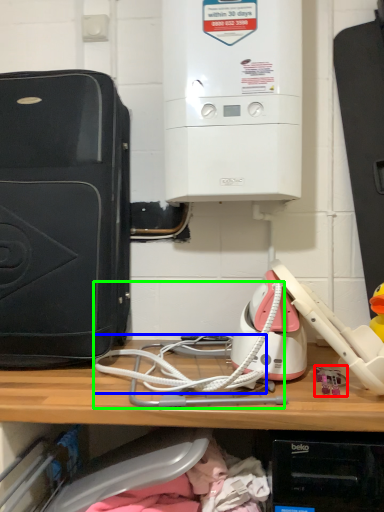
Question: Estimate the real-world distances between objects in this image. Which object is closer to toy (highlighted by a red box), wire (highlighted by a blue box) or wire (highlighted by a green box)?

Choices:
 (A) wire
 (B) wire

Answer: (B)